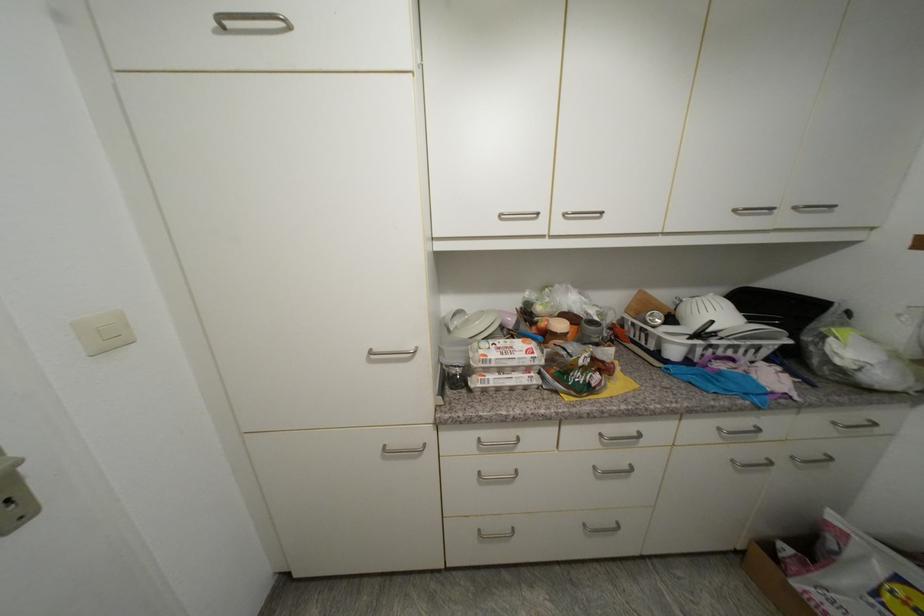
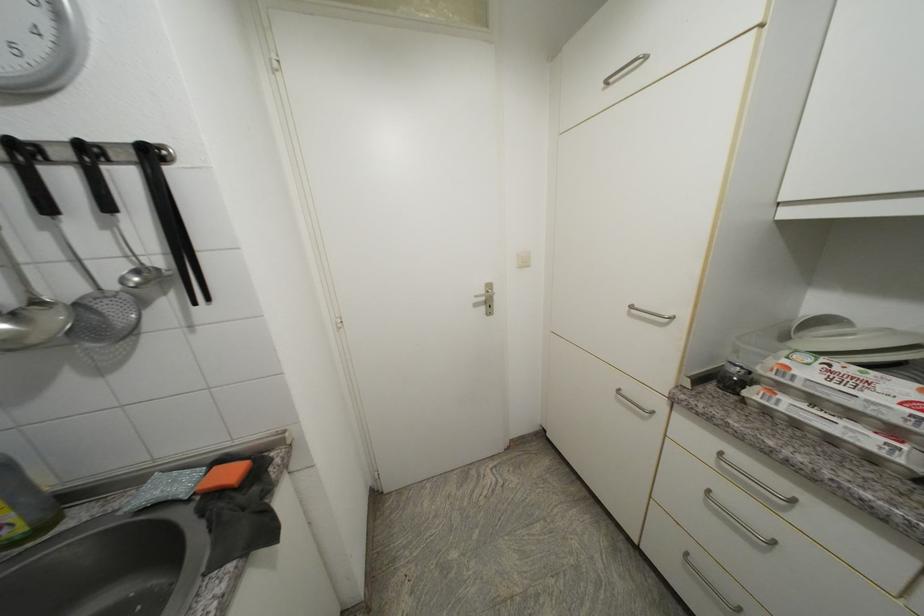
Question: The camera is either moving clockwise (left) or counter-clockwise (right) around the object. The first image is from the beginning of the video and the second image is from the end. Is the camera moving left or right when shooting the video?

Choices:
 (A) Left
 (B) Right

Answer: (B)